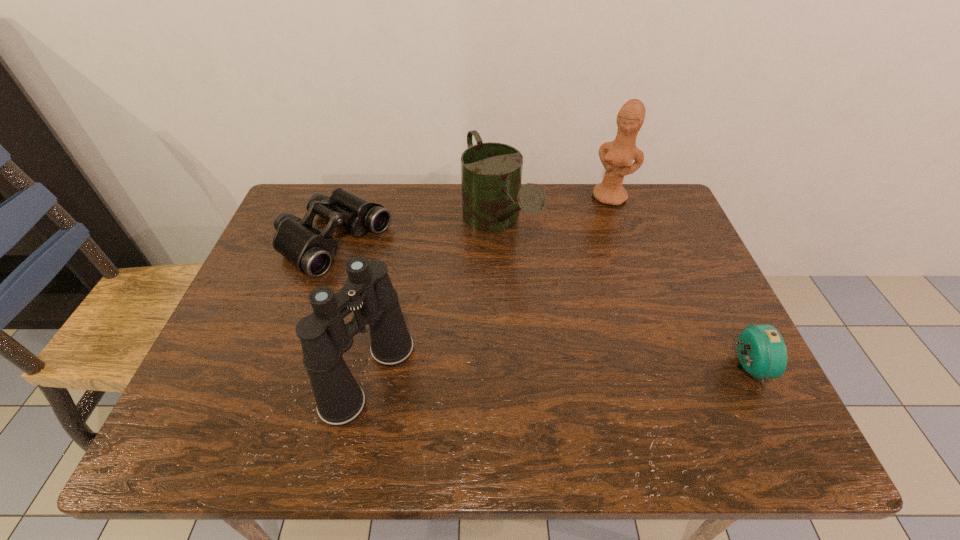
In the image, there is a desktop. What are the coordinates of `vacant space at the near left corner` in the screenshot? It's located at pyautogui.click(x=272, y=373).

This screenshot has width=960, height=540. Find the location of `unoccupied area between the fourth object from left to right and the watering can`. unoccupied area between the fourth object from left to right and the watering can is located at coordinates (555, 211).

In order to click on free space that is in between the third object from left to right and the farther binoculars in this screenshot , I will do click(x=416, y=233).

The width and height of the screenshot is (960, 540). Find the location of `vacant space that's between the taller binoculars and the watering can`. vacant space that's between the taller binoculars and the watering can is located at coordinates (434, 300).

Where is `vacant area that lies between the alarm clock and the figurine`? vacant area that lies between the alarm clock and the figurine is located at coordinates (679, 282).

The height and width of the screenshot is (540, 960). I want to click on vacant space that's between the alarm clock and the nearer binoculars, so click(557, 372).

Locate an element on the screen. The height and width of the screenshot is (540, 960). vacant area that lies between the third object from left to right and the figurine is located at coordinates (555, 211).

At what (x,y) coordinates should I click in order to perform the action: click on free area in between the figurine and the third object from right to left. Please return your answer as a coordinate pair (x, y). This screenshot has width=960, height=540. Looking at the image, I should click on (555, 211).

Where is `unoccupied area between the third shortest object and the rightmost object`? This screenshot has width=960, height=540. unoccupied area between the third shortest object and the rightmost object is located at coordinates (622, 295).

The width and height of the screenshot is (960, 540). I want to click on the third closest object to the figurine, so click(309, 250).